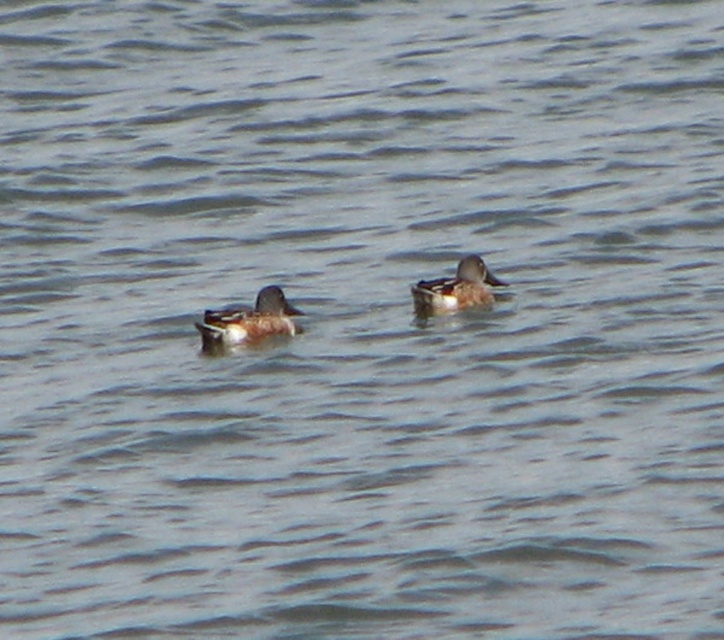
You are standing on the edge of the water and see the brown matte duck at center. If you want to throw a small pebble to make a ripple near the duck, will you need to throw it more than 15 feet?

The brown matte duck at center is 17.43 feet away from the viewer. Since 17.43 feet is more than 15 feet, you will need to throw the pebble more than 15 feet to reach the duck.

You are observing two ducks swimming in the water. From your viewpoint, which duck is positioned lower in the image, the brown matte duck at center or the brown speckled duck at center?

The brown matte duck at center is located below the brown speckled duck at center, so it is positioned lower in the image.

You are a wildlife photographer trying to capture both ducks in a single shot. Given that your camera can only focus on objects wider than 10 cm, can you confirm if both the brown matte duck at center and the brown speckled duck at center meet the minimum width requirement?

The brown matte duck at center has a lesser width compared to brown speckled duck at center. Since the speckled duck is wider, it likely exceeds the 10 cm requirement. However, without knowing the exact width of the matte duck, we cannot confirm if it meets the 10 cm minimum. Please measure both ducks to ensure compliance.